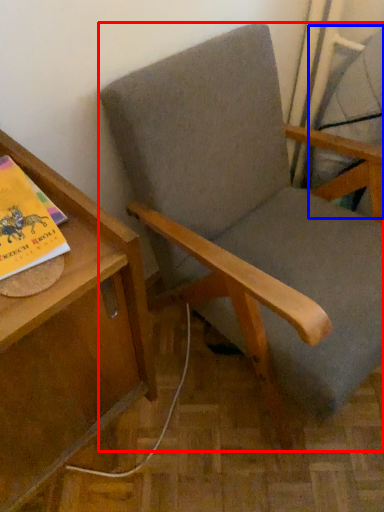
Question: Which of the following is the closest to the observer, chair (highlighted by a red box) or swivel chair (highlighted by a blue box)?

Choices:
 (A) chair
 (B) swivel chair

Answer: (A)